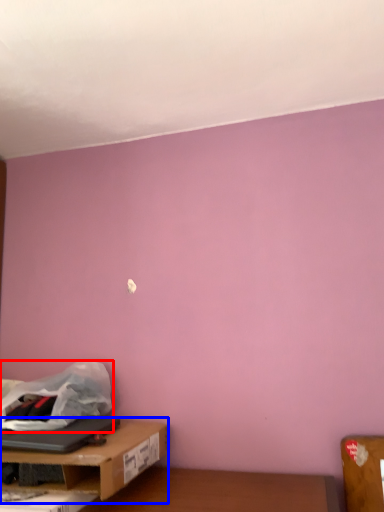
Question: Which object is further to the camera taking this photo, plastic bag (highlighted by a red box) or table (highlighted by a blue box)?

Choices:
 (A) plastic bag
 (B) table

Answer: (A)